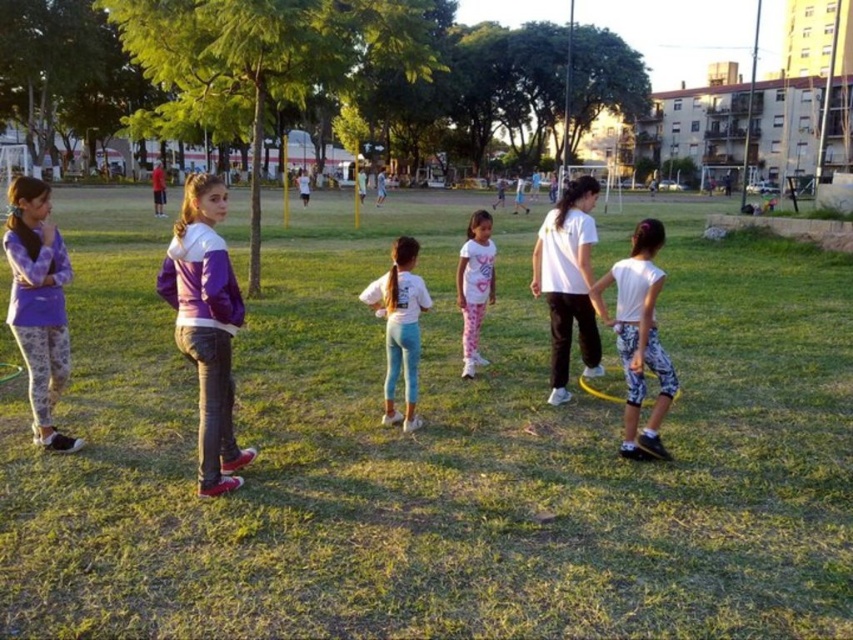
Looking at this image, you are standing at the center of the park and see the point marked at coordinates (436, 452). What is located at that point?

The point marked at coordinates (436, 452) is green grass at center.

You are a photographer trying to capture a photo of the white matte hula hoop at center and the white printed leggings at center. Which object should you focus on first if you want to ensure both are in focus without adjusting your camera settings?

The white matte hula hoop at center is shorter than white printed leggings at center, so you should focus on the white printed leggings at center first to ensure both are in focus.

You are a photographer setting up a tripod in the park. You need to ensure that both the purple fleece jacket at left and the white matte leggings at center are visible in your shot. Given their positions and sizes, which object should you focus on first to frame the shot properly?

The purple fleece jacket at left is taller than the white matte leggings at center, so you should focus on the purple fleece jacket at left first to ensure it fits within the frame before adjusting for the smaller white matte leggings at center.